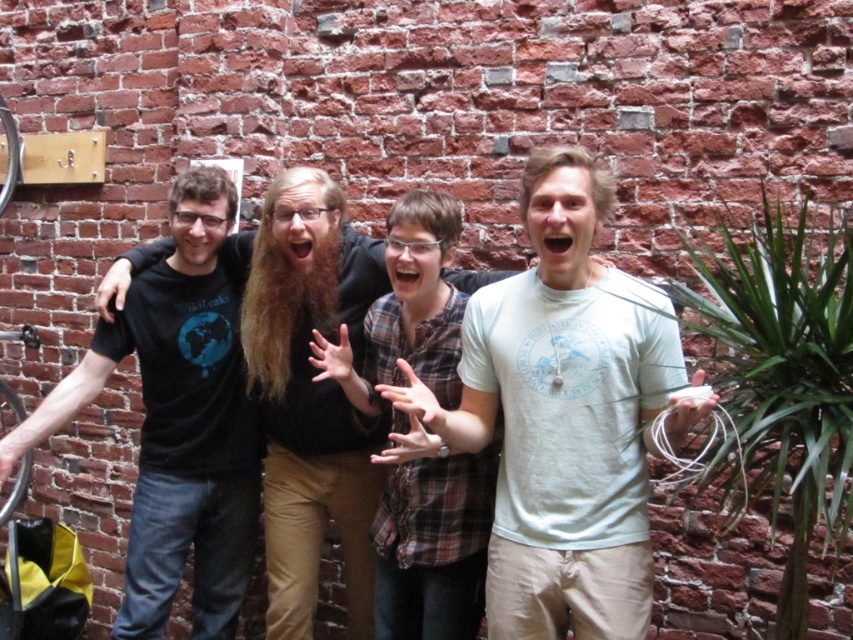
Is green leafy plant at right wider than black matte t-shirt at center?

Indeed, green leafy plant at right has a greater width compared to black matte t-shirt at center.

Who is more forward, (x=833, y=220) or (x=285, y=182)?

Point (x=833, y=220) is in front.

Measure the distance between green leafy plant at right and camera.

The distance of green leafy plant at right from camera is 2.39 meters.

Find the location of a particular element. This screenshot has width=853, height=640. green leafy plant at right is located at coordinates (778, 380).

Which is more to the left, black matte t-shirt at left or green leafy plant at right?

From the viewer's perspective, black matte t-shirt at left appears more on the left side.

Is point (196, 413) in front of point (833, 284)?

No.

The image size is (853, 640). Identify the location of black matte t-shirt at left. (178, 417).

Is white cotton t-shirt at center wider than black matte t-shirt at center?

Yes, white cotton t-shirt at center is wider than black matte t-shirt at center.

Can you confirm if white cotton t-shirt at center is smaller than black matte t-shirt at center?

Incorrect, white cotton t-shirt at center is not smaller in size than black matte t-shirt at center.

Which is in front, point (561, 420) or point (312, 605)?

Point (561, 420)

The width and height of the screenshot is (853, 640). I want to click on white cotton t-shirt at center, so click(561, 417).